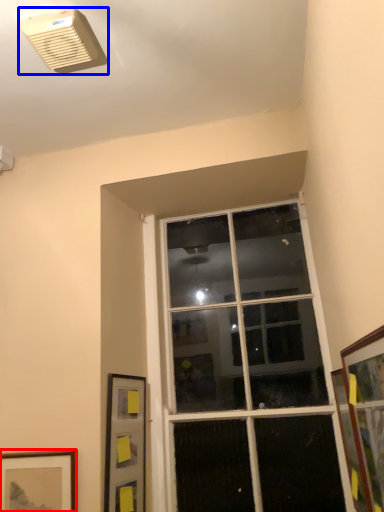
Question: Among these objects, which one is nearest to the camera, picture frame (highlighted by a red box) or air conditioning (highlighted by a blue box)?

Choices:
 (A) picture frame
 (B) air conditioning

Answer: (B)